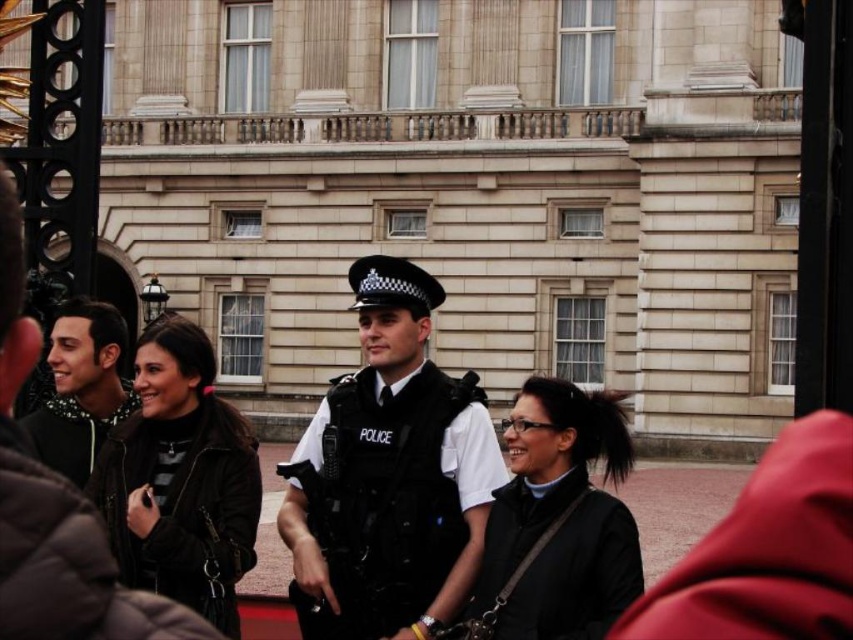
You are standing at the point marked as point (471, 193) in the image. What structure are you directly in front of?

The point (471, 193) is on the beige stone building at center, so you are directly in front of the beige stone building at center.

You are a photographer trying to capture a wide shot of the scene outside the grand building. You notice the black uniformed police officer at center and the matte black jacket at left. Which object should you focus on to ensure it fits entirely within your camera frame if you can only capture one object at a time?

You should focus on the matte black jacket at left because the black uniformed police officer at center is wider than the matte black jacket at left, making the jacket easier to fit within the camera frame.